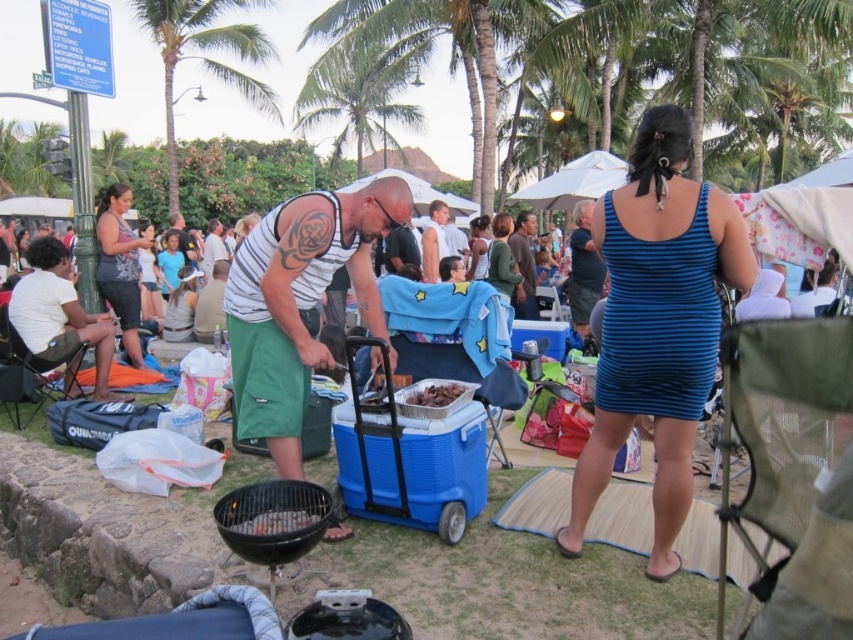
What is the exact location of the light brown skin at center in the image?

The light brown skin at center is located at point coordinates of 0.378 on the x axis and 0.509 on the y axis.

You are a guest at the barbecue and want to place a plate of food between the light brown skin at center and the charcoal briquettes at center. Which object should you move to make space?

The light brown skin at center is thinner than the charcoal briquettes at center, so you should move the charcoal briquettes at center to make space because it takes up more width.